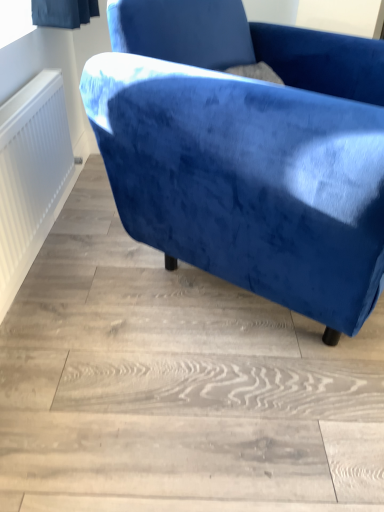
Locate an element on the screen. The width and height of the screenshot is (384, 512). free space in front of white textured radiator at left is located at coordinates (84, 328).